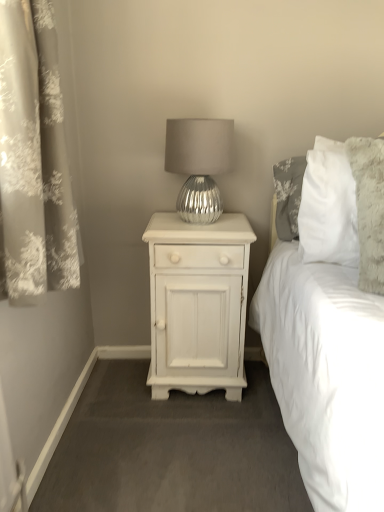
This screenshot has width=384, height=512. Find the location of `free space in front of white painted wood nightstand at center`. free space in front of white painted wood nightstand at center is located at coordinates (195, 438).